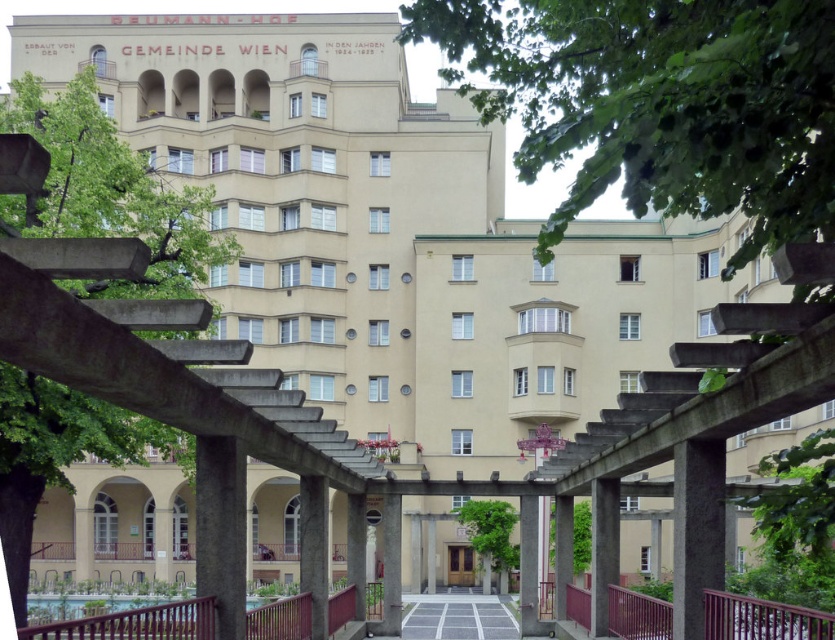
You are standing in front of the REHMANN_HOF building and want to take a photo of the point at coordinates (196, 600). If your camera has a maximum focus range of 25 meters, will it be able to focus on that point?

The point at coordinates (196, 600) is 24.41 meters away from the camera, which is within the maximum focus range of 25 meters. Therefore, the camera can focus on that point.

From the picture: You are a visitor approaching the building and want to walk along the gray concrete path at center. However, there is a metallic burgundy railing at lower center in your way. Can you walk around it easily?

The metallic burgundy railing at lower center has a smaller size compared to the gray concrete path at center, so yes, you can walk around it easily since the path is wider than the railing.

In the scene shown: You are a landscape architect designing a garden around the REHMANN_HOF building. You need to place a new bench that is 1.2 meters wide. Which object, the metallic burgundy railing at lower center or the gray concrete path at center, would allow the bench to be placed next to it without overlapping?

The gray concrete path at center is wider than the metallic burgundy railing at lower center. Since the bench is 1.2 meters wide, it would fit better next to the gray concrete path at center as it provides more space compared to the thinner railing.